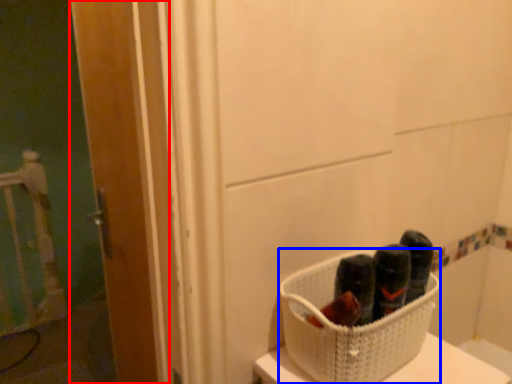
Question: Which of the following is the closest to the observer, door (highlighted by a red box) or basket (highlighted by a blue box)?

Choices:
 (A) door
 (B) basket

Answer: (B)